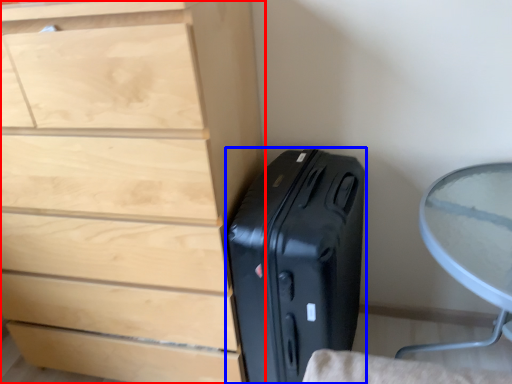
Question: Which point is closer to the camera, chest of drawers (highlighted by a red box) or suitcase (highlighted by a blue box)?

Choices:
 (A) chest of drawers
 (B) suitcase

Answer: (A)